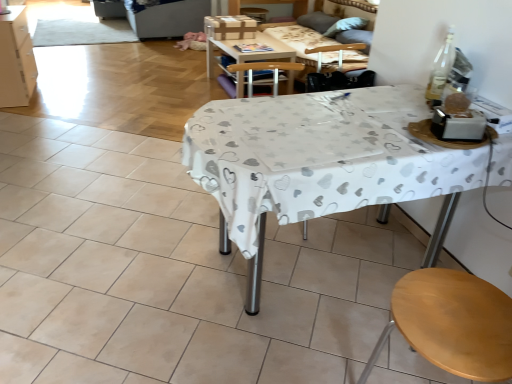
The width and height of the screenshot is (512, 384). In order to click on vacant region to the left of wooden table at center in this screenshot , I will do `click(175, 87)`.